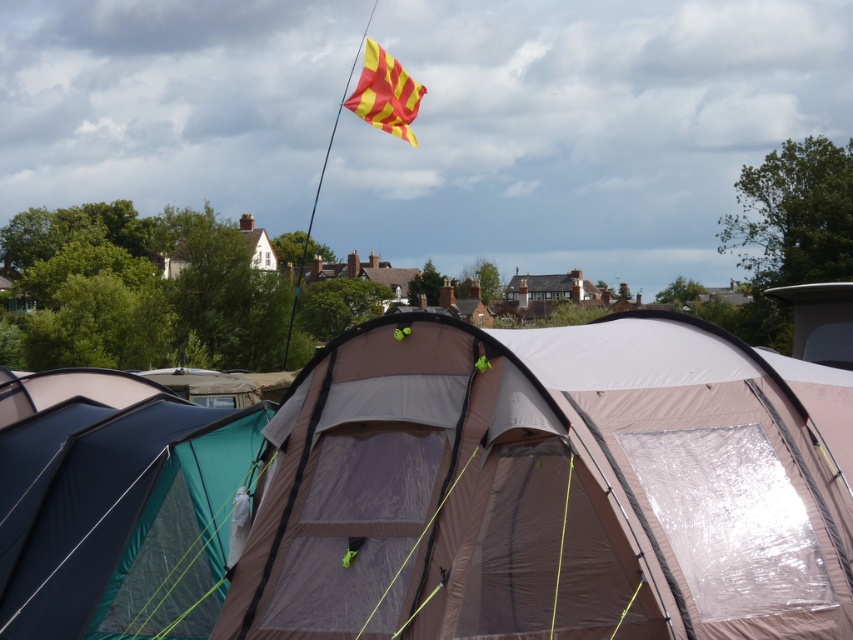
Question: Among these points, which one is farthest from the camera?

Choices:
 (A) pos(399,394)
 (B) pos(346,104)
 (C) pos(73,600)

Answer: (B)

Question: Does matte brown tent at center have a larger size compared to teal fabric tent at lower left?

Choices:
 (A) no
 (B) yes

Answer: (B)

Question: Which object is farther from the camera taking this photo?

Choices:
 (A) teal fabric tent at lower left
 (B) matte brown tent at center

Answer: (A)

Question: From the image, what is the correct spatial relationship of matte brown tent at center in relation to yellowmaterial/texture flag at upper center?

Choices:
 (A) right
 (B) left

Answer: (A)

Question: Which object is closer to the camera taking this photo?

Choices:
 (A) yellowmaterial/texture flag at upper center
 (B) matte brown tent at center
 (C) teal fabric tent at lower left

Answer: (B)

Question: From the image, what is the correct spatial relationship of matte brown tent at center in relation to teal fabric tent at lower left?

Choices:
 (A) below
 (B) above

Answer: (B)